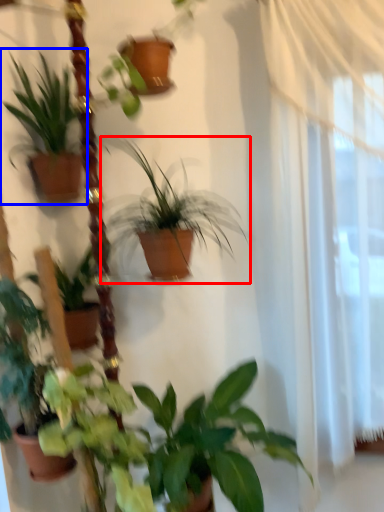
Question: Which point is further to the camera, houseplant (highlighted by a red box) or houseplant (highlighted by a blue box)?

Choices:
 (A) houseplant
 (B) houseplant

Answer: (B)